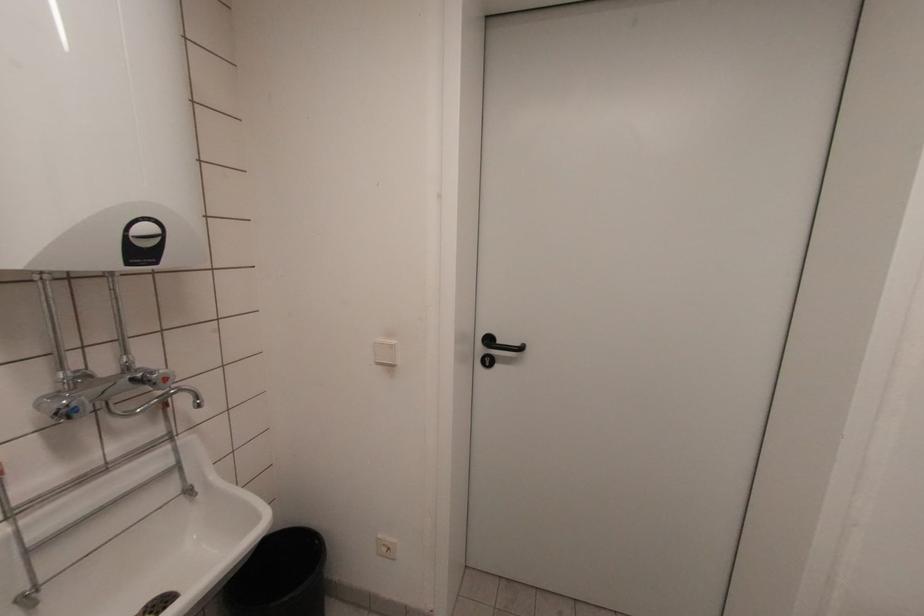
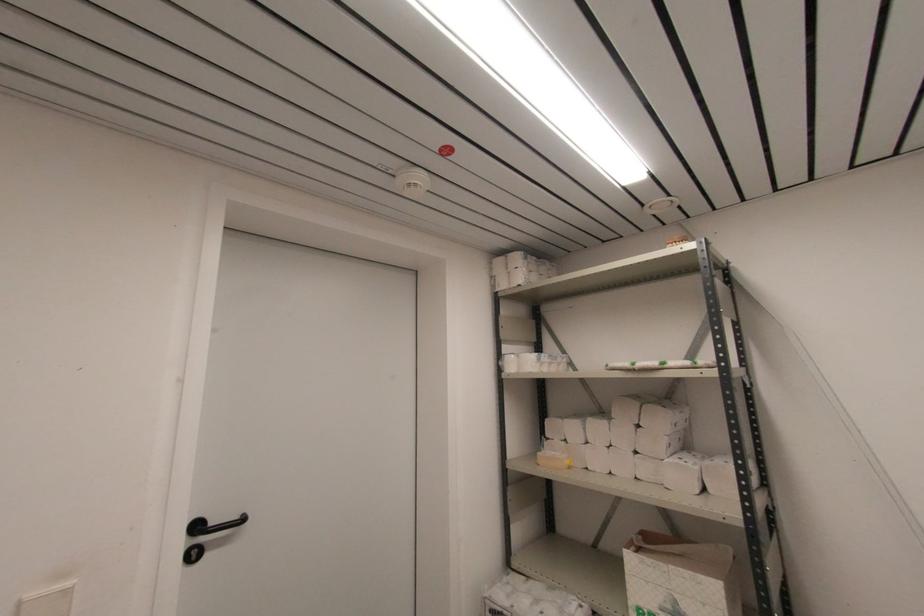
In the second image, find the point that corresponds to (488,363) in the first image.

(196, 557)